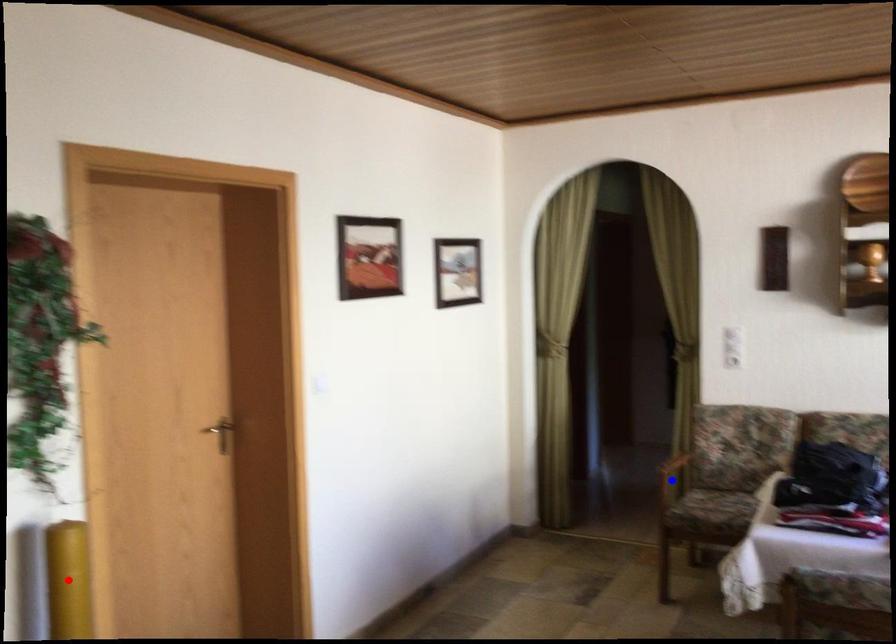
Question: Two points are marked on the image. Which point is closer to the camera?

Choices:
 (A) Blue point is closer.
 (B) Red point is closer.

Answer: (B)